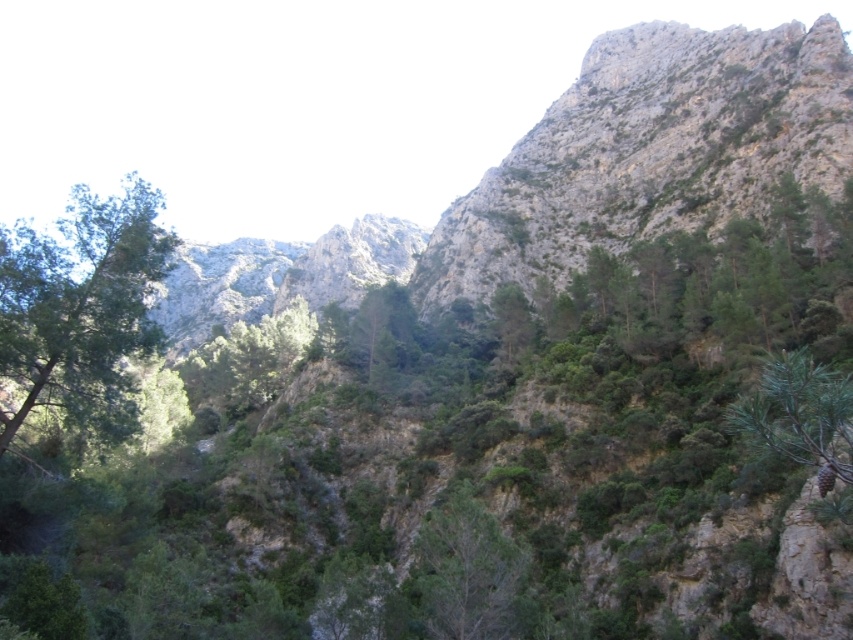
Question: Which of the following is the closest to the observer?

Choices:
 (A) pos(779,388)
 (B) pos(846,113)
 (C) pos(486,577)
 (D) pos(3,230)

Answer: (A)

Question: Does rugged stone mountain at upper right lie in front of green leafy tree at center?

Choices:
 (A) no
 (B) yes

Answer: (A)

Question: Is rugged stone mountain at upper right above green matte pine cone at right?

Choices:
 (A) no
 (B) yes

Answer: (B)

Question: Which of the following is the closest to the observer?

Choices:
 (A) (474, 547)
 (B) (540, 221)
 (C) (106, 435)

Answer: (A)

Question: Does rugged stone mountain at upper right appear under green leafy tree at left?

Choices:
 (A) yes
 (B) no

Answer: (A)

Question: Among these objects, which one is farthest from the camera?

Choices:
 (A) rugged stone mountain at upper right
 (B) green leafy tree at left
 (C) green leafy tree at center
 (D) green matte pine cone at right

Answer: (A)